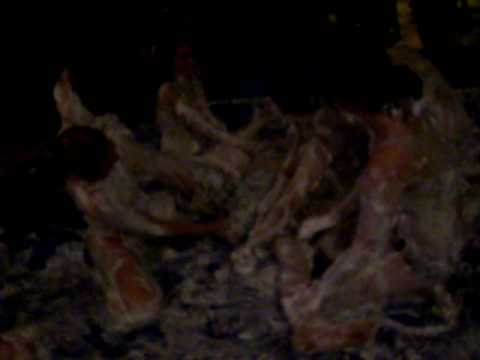
Where is `hook`? The width and height of the screenshot is (480, 360). hook is located at coordinates point(60,102).